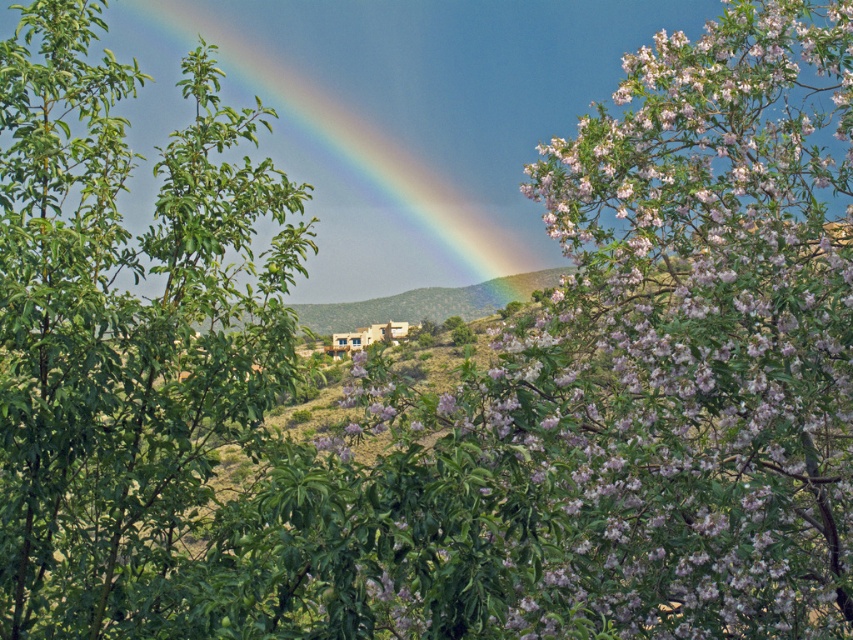
Question: Is pink bloom at center positioned at the back of rainbow at upper center?

Choices:
 (A) yes
 (B) no

Answer: (B)

Question: Which object is closer to the camera taking this photo?

Choices:
 (A) pink bloom at center
 (B) rainbow at upper center

Answer: (A)

Question: Considering the real-world distances, which object is farthest from the pink bloom at center?

Choices:
 (A) green leafy tree at left
 (B) rainbow at upper center

Answer: (B)

Question: Which of the following is the closest to the observer?

Choices:
 (A) green leafy tree at left
 (B) rainbow at upper center
 (C) pink bloom at center

Answer: (C)

Question: Can you confirm if green leafy tree at left is positioned above rainbow at upper center?

Choices:
 (A) no
 (B) yes

Answer: (A)

Question: From the image, what is the correct spatial relationship of pink bloom at center in relation to rainbow at upper center?

Choices:
 (A) right
 (B) left

Answer: (A)